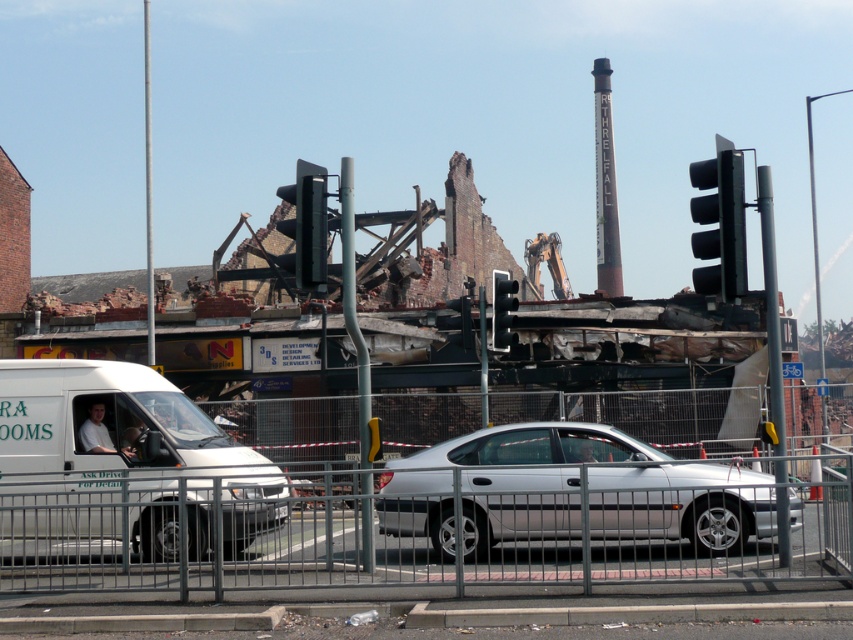
Question: Is metallic silver fence at lower center behind silver metallic car at center?

Choices:
 (A) no
 (B) yes

Answer: (A)

Question: Estimate the real-world distances between objects in this image. Which object is closer to the white matte van at center?

Choices:
 (A) black matte traffic light at center
 (B) black plastic traffic light at upper right
 (C) silver metallic car at center
 (D) black plastic traffic light at center

Answer: (A)

Question: Is black matte traffic light at center bigger than black plastic traffic light at center?

Choices:
 (A) yes
 (B) no

Answer: (A)

Question: Which point is farther from the camera taking this photo?

Choices:
 (A) click(418, 472)
 (B) click(721, 198)

Answer: (A)

Question: Is silver metallic car at center to the right of black plastic traffic light at upper right from the viewer's perspective?

Choices:
 (A) yes
 (B) no

Answer: (B)

Question: Which of the following is the farthest from the observer?

Choices:
 (A) metallic silver fence at lower center
 (B) black matte traffic light at center
 (C) black plastic traffic light at center
 (D) silver metallic car at center

Answer: (C)